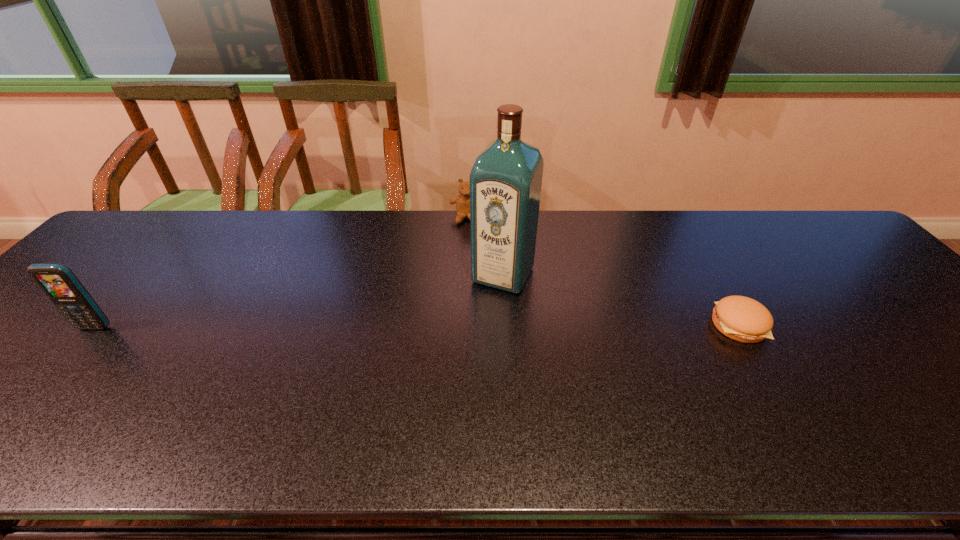
Identify the location of free space between the second farthest object and the patty. Image resolution: width=960 pixels, height=540 pixels. (621, 300).

Select which object is the second closest to the cellular telephone. Please provide its 2D coordinates. Your answer should be formatted as a tuple, i.e. [(x, y)], where the tuple contains the x and y coordinates of a point satisfying the conditions above.

[(462, 201)]

Locate an element on the screen. This screenshot has height=540, width=960. object that is the third nearest to the liquor is located at coordinates (58, 282).

What are the coordinates of `vacant point that satisfies the following two spatial constraints: 1. on the front side of the teddy bear; 2. on the left side of the rightmost object` in the screenshot? It's located at (463, 325).